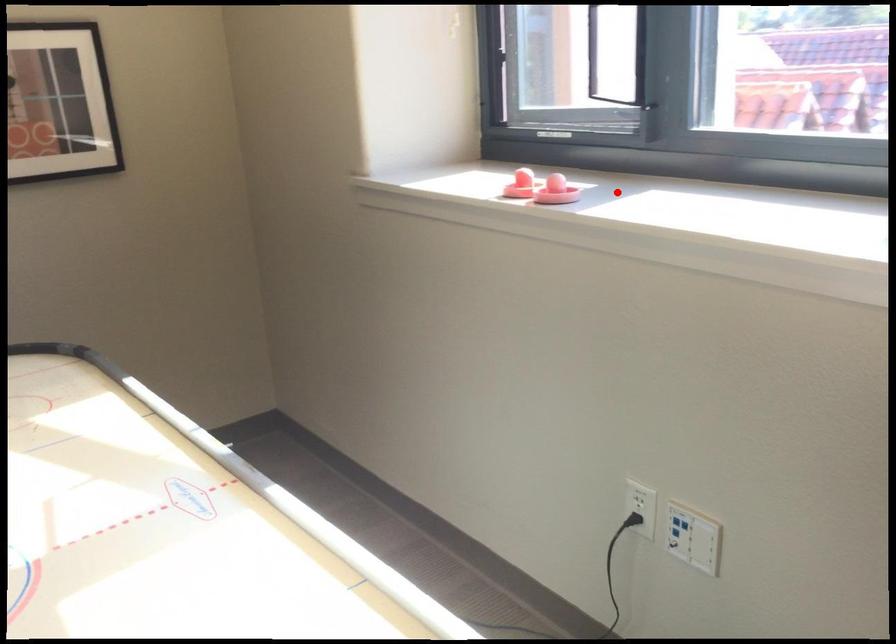
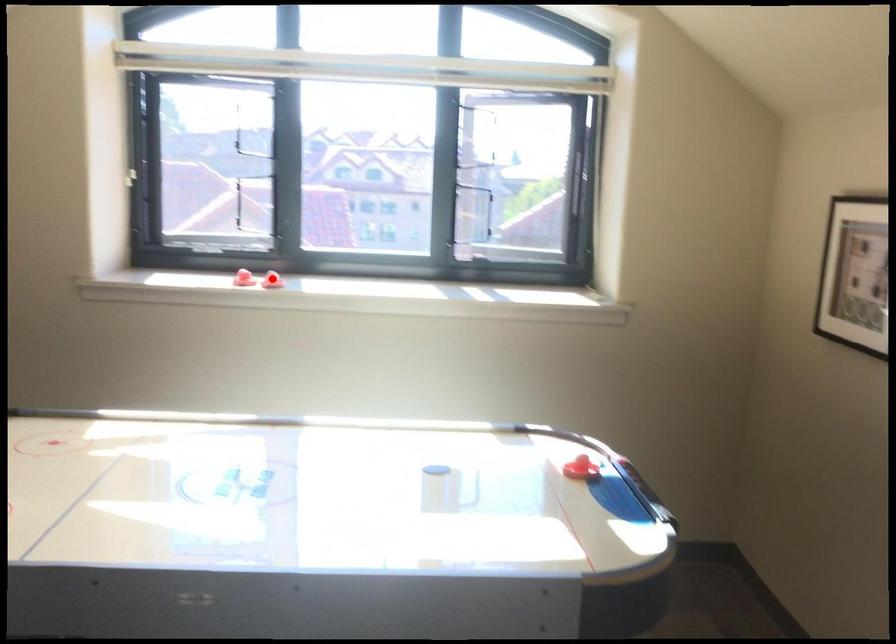
Looking at this image, I am providing you with two images of the same scene from different viewpoints. A red point is marked on the first image and another point is marked on the second image. Is the red point in image1 aligned with the point shown in image2?

Yes